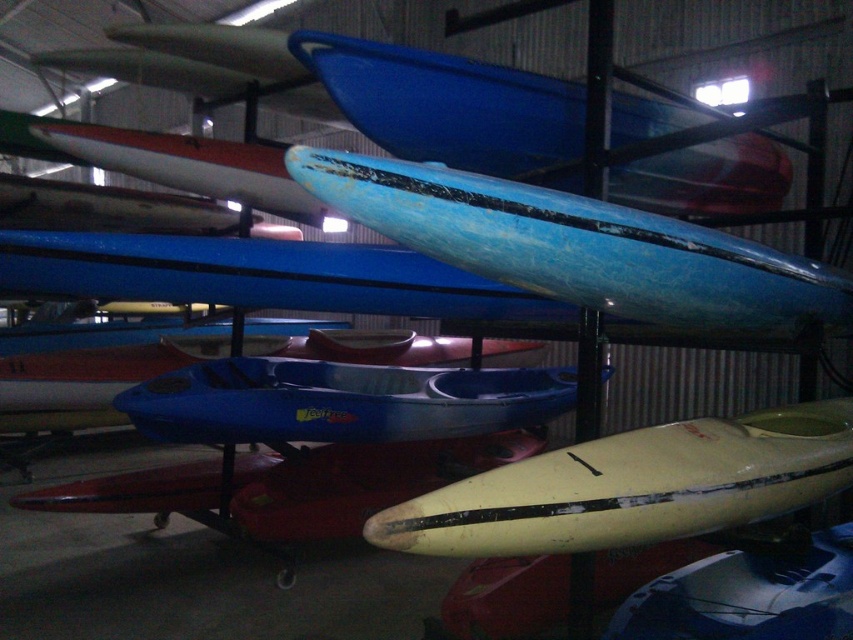
You are an employee at the storage facility and need to determine if the blue matte kayak at center can fit through a doorway that is the same width as the yellow matte kayak at center. Can it fit?

The blue matte kayak at center might be wider than yellow matte kayak at center, so it might not fit through the doorway if the doorway is exactly the width of the yellow matte kayak at center.